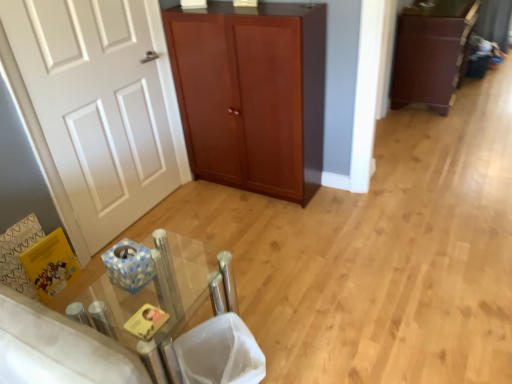
Question: Based on their sizes in the image, would you say clear glass table at center is bigger or smaller than dark brown wood cabinet at right?

Choices:
 (A) big
 (B) small

Answer: (B)

Question: In terms of width, does clear glass table at center look wider or thinner when compared to dark brown wood cabinet at right?

Choices:
 (A) thin
 (B) wide

Answer: (A)

Question: Based on their relative distances, which object is farther from the white mesh laundry basket at lower center?

Choices:
 (A) dark brown wood cabinet at right
 (B) white matte door at left
 (C) clear glass table at center
 (D) mahogany wood cupboard at center

Answer: (A)

Question: Estimate the real-world distances between objects in this image. Which object is farther from the white mesh laundry basket at lower center?

Choices:
 (A) clear glass table at center
 (B) mahogany wood cupboard at center
 (C) dark brown wood cabinet at right
 (D) white matte door at left

Answer: (C)